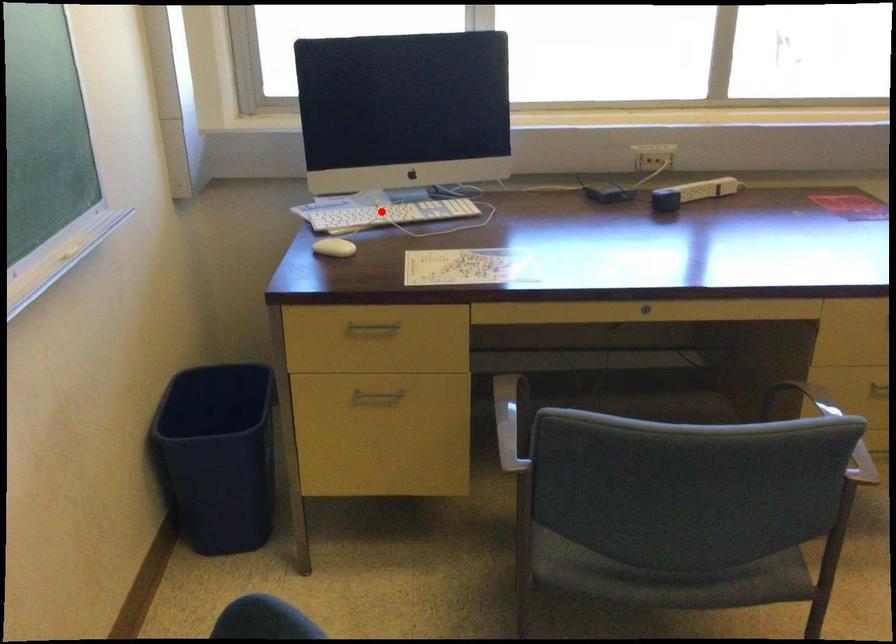
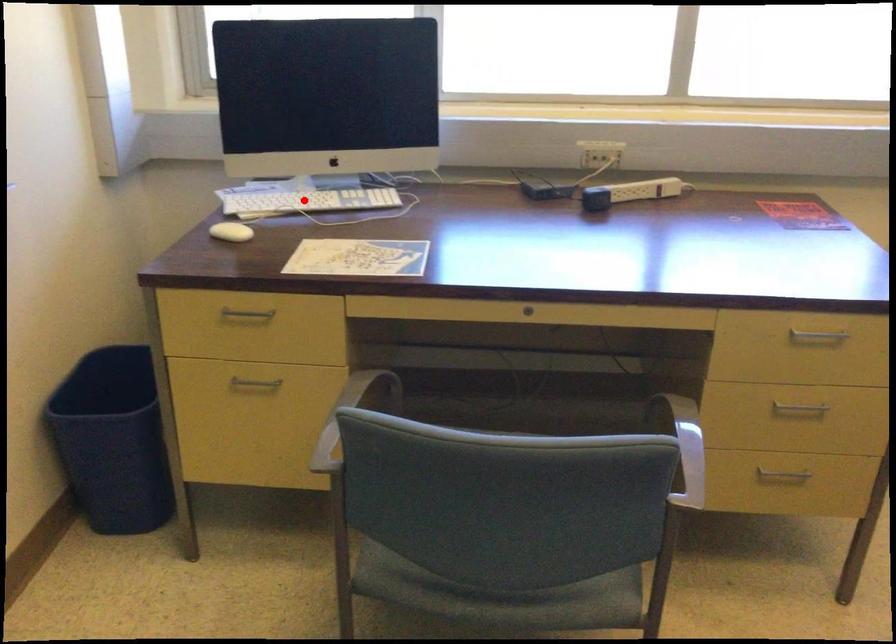
I am providing you with two images of the same scene from different viewpoints. A red point is marked on the first image and another point is marked on the second image. Is the red point in image1 aligned with the point shown in image2?

Yes